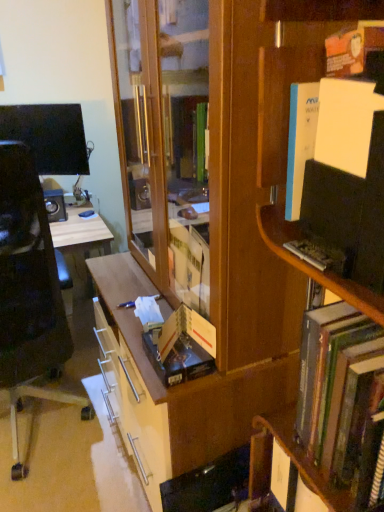
This screenshot has height=512, width=384. What do you see at coordinates (29, 293) in the screenshot?
I see `black plastic chair at left` at bounding box center [29, 293].

In order to face hardcover book at center, should I rotate leftwards or rightwards?

You should look left and rotate roughly 2.080 degrees.

What is the approximate width of wooden bookshelf at right?

The width of wooden bookshelf at right is 14.31 inches.

This screenshot has width=384, height=512. I want to click on wooden bookcase at center, so click(x=248, y=213).

Is wooden bookshelf at right in front of or behind black plastic chair at left in the image?

wooden bookshelf at right is in front of black plastic chair at left.

Is wooden bookshelf at right to the right of black plastic chair at left from the viewer's perspective?

Yes, wooden bookshelf at right is to the right of black plastic chair at left.

Is wooden bookshelf at right oriented towards black plastic chair at left?

No, wooden bookshelf at right is not oriented towards black plastic chair at left.

How many degrees apart are the facing directions of wooden bookshelf at right and black plastic chair at left?

wooden bookshelf at right and black plastic chair at left are facing 87.2 degrees away from each other.

From the image's perspective, is hardcover book at right located beneath wooden bookshelf at right?

Actually, hardcover book at right appears above wooden bookshelf at right in the image.

Does hardcover book at right have a smaller size compared to wooden bookshelf at right?

Yes, hardcover book at right is smaller than wooden bookshelf at right.

Based on their positions, is hardcover book at right located to the left or right of wooden bookshelf at right?

From the image, it's evident that hardcover book at right is to the left of wooden bookshelf at right.

Are hardcover book at center and black plastic chair at left making contact?

No, hardcover book at center is not in contact with black plastic chair at left.

Is hardcover book at center at the left side of black plastic chair at left?

In fact, hardcover book at center is to the right of black plastic chair at left.

Between point (187, 321) and point (51, 358), which one is positioned in front?

The point (187, 321) is in front.

From the image's perspective, is wooden bookshelf at right over hardcover book at right?

No, from the image's perspective, wooden bookshelf at right is not over hardcover book at right.

Is the depth of wooden bookshelf at right greater than that of hardcover book at right?

No.

Which of these two, wooden bookshelf at right or hardcover book at right, is smaller?

hardcover book at right is smaller.

Is wooden bookshelf at right aimed at hardcover book at right?

Yes, wooden bookshelf at right faces towards hardcover book at right.

Find the location of a particular element. This screenshot has height=512, width=384. paperback book that appears on the left of hardcover book at right is located at coordinates (186, 331).

Considering the sizes of hardcover book at center and hardcover book at right in the image, is hardcover book at center bigger or smaller than hardcover book at right?

Considering their sizes, hardcover book at center takes up less space than hardcover book at right.

From a real-world perspective, between hardcover book at center and hardcover book at right, who is vertically higher?

hardcover book at right is physically above.

Measure the distance between hardcover book at center and hardcover book at right.

They are 43.59 centimeters apart.

Consider the image. Which is correct: wooden bookcase at center is inside hardcover book at center, or outside of it?

The correct answer is: outside.

Can you confirm if wooden bookcase at center is wider than hardcover book at center?

Indeed, wooden bookcase at center has a greater width compared to hardcover book at center.

Between wooden bookcase at center and hardcover book at center, which one appears on the right side from the viewer's perspective?

hardcover book at center is more to the right.

Considering the relative sizes of wooden bookcase at center and hardcover book at center in the image provided, is wooden bookcase at center bigger than hardcover book at center?

Indeed, wooden bookcase at center has a larger size compared to hardcover book at center.

Would you say hardcover book at center is inside or outside wooden bookshelf at right?

hardcover book at center is outside wooden bookshelf at right.

Which is further, (187, 308) or (280, 130)?

The point (187, 308) is more distant.

Is hardcover book at center not close to wooden bookshelf at right?

No, hardcover book at center is not far from wooden bookshelf at right.

Between hardcover book at center and wooden bookshelf at right, which one has larger width?

Wider between the two is wooden bookshelf at right.

The image size is (384, 512). In order to click on shelf on the right of black plastic chair at left in this screenshot , I will do `click(277, 108)`.

The height and width of the screenshot is (512, 384). What are the coordinates of `book behind the wooden bookshelf at right` in the screenshot? It's located at (335, 384).

Based on their spatial positions, is wooden bookcase at center or black plastic chair at left closer to hardcover book at right?

wooden bookcase at center lies closer to hardcover book at right than the other object.

When comparing their distances from hardcover book at right, does wooden bookshelf at right or wooden bookcase at center seem further?

Among the two, wooden bookcase at center is located further to hardcover book at right.

Considering their positions, is hardcover book at right positioned closer to wooden bookcase at center than black plastic chair at left?

hardcover book at right is closer to wooden bookcase at center.

From the image, which object appears to be farther from black plastic chair at left, wooden bookshelf at right or wooden bookcase at center?

Among the two, wooden bookshelf at right is located further to black plastic chair at left.

Based on the photo, when comparing their distances from black plastic chair at left, does hardcover book at right or hardcover book at center seem closer?

Based on the image, hardcover book at center appears to be nearer to black plastic chair at left.

Which object lies nearer to the anchor point wooden bookshelf at right, hardcover book at right or black plastic chair at left?

hardcover book at right is positioned closer to the anchor wooden bookshelf at right.

Estimate the real-world distances between objects in this image. Which object is further from wooden bookshelf at right, hardcover book at center or black plastic chair at left?

Among the two, black plastic chair at left is located further to wooden bookshelf at right.

Looking at the image, which one is located closer to wooden bookcase at center, hardcover book at right or hardcover book at center?

Among the two, hardcover book at center is located nearer to wooden bookcase at center.

This screenshot has width=384, height=512. In order to click on bookcase situated between black plastic chair at left and hardcover book at right from left to right in this screenshot , I will do `click(248, 213)`.

Where is `bookcase situated between black plastic chair at left and wooden bookshelf at right from left to right`? This screenshot has height=512, width=384. bookcase situated between black plastic chair at left and wooden bookshelf at right from left to right is located at coordinates pos(248,213).

At what (x,y) coordinates should I click in order to perform the action: click on book situated between wooden bookcase at center and wooden bookshelf at right from left to right. Please return your answer as a coordinate pair (x, y). Looking at the image, I should click on (335, 384).

Where is `book between wooden bookshelf at right and hardcover book at center from front to back`? book between wooden bookshelf at right and hardcover book at center from front to back is located at coordinates (335, 384).